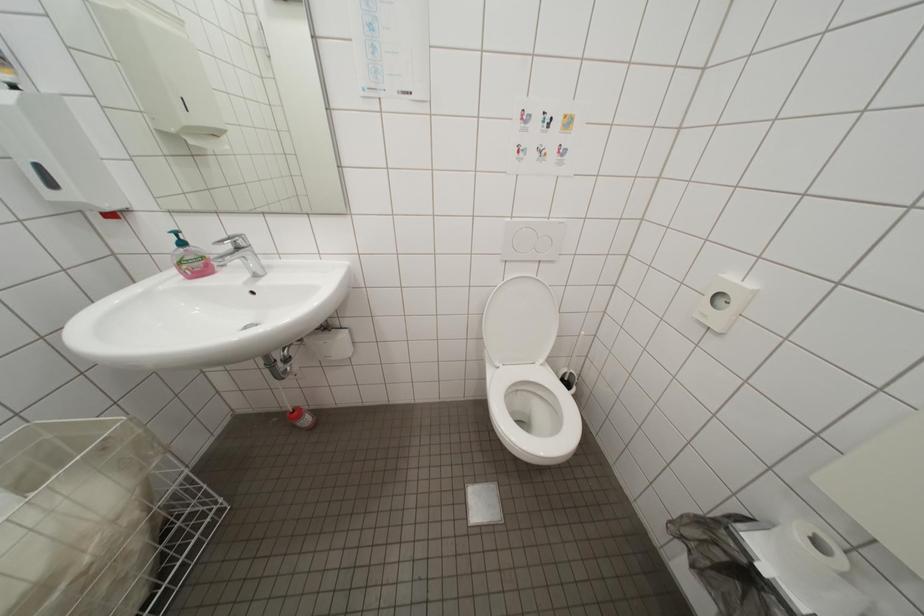
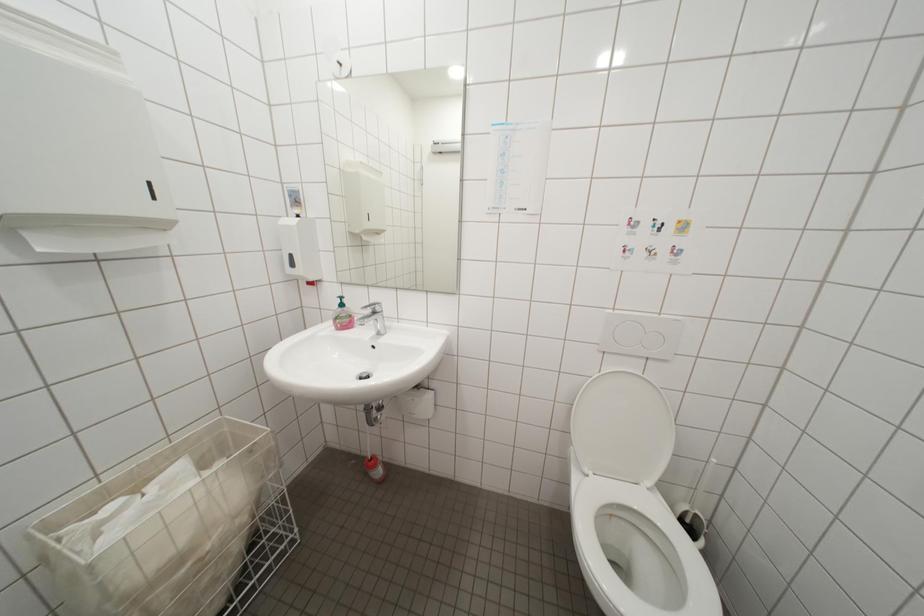
In a continuous first-person perspective shot, in which direction is the camera moving?

The movement direction of the cameraman is left, backward.